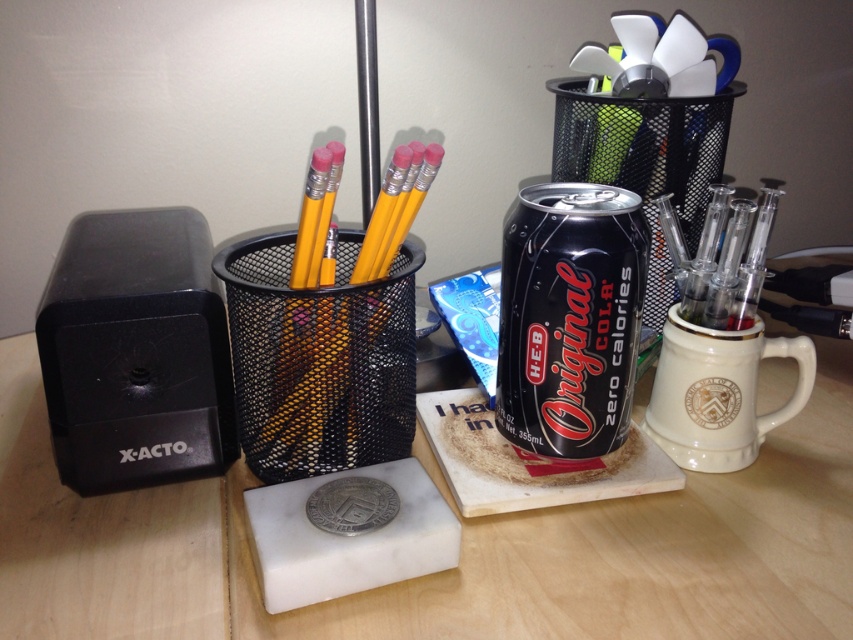
You are organizing a small tea party and need to place a teapot that requires 20 cm of space. The wooden table at center and white ceramic mug at right are on the desk. Which object can accommodate the teapot?

The wooden table at center has a larger size compared to the white ceramic mug at right, so the wooden table at center can accommodate the teapot that requires 20 cm of space.

From the picture: You are standing 24 inches away from the desk setup. Can you see the point at coordinates point (650,609) clearly?

The point (650,609) is 20.48 inches away from the camera, so yes, you can see it clearly since you are standing 24 inches away from the desk setup.

You are a barista who needs to place a new coffee cup on the wooden table at center. The cup is the same height as the white ceramic mug at right. Can you safely place it there without it being too tall?

The wooden table at center is taller than the white ceramic mug at right, so placing a cup of the same height would be safe as it won